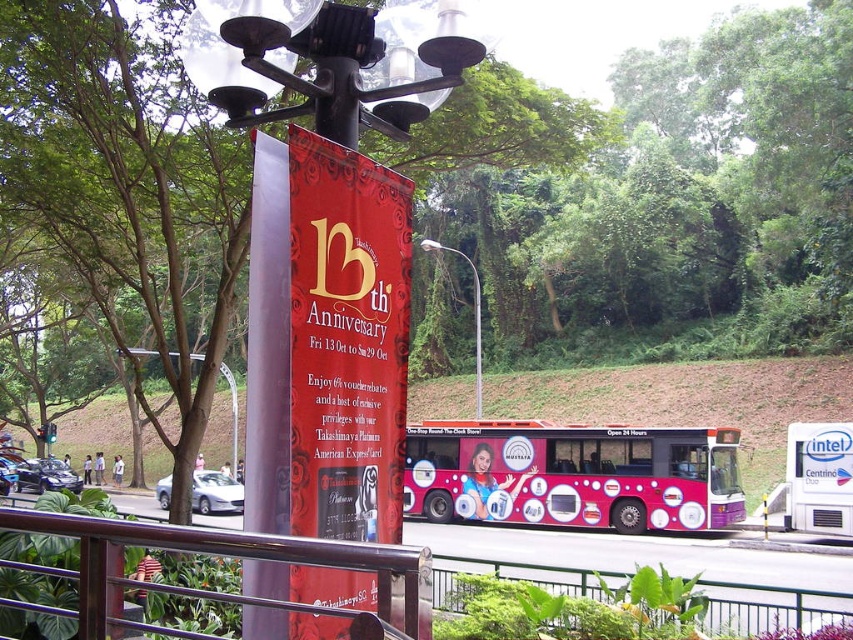
You are a photographer trying to capture the shiny pink bus at center and the metallic silver streetlight at center in a single frame. Based on their positions, which object is casting a shadow on the other?

The metallic silver streetlight at center is casting a shadow on the shiny pink bus at center because the bus is positioned under the streetlight.

You are a pedestrian standing at the lamppost with the red banner. You see a shiny pink bus at center and a metallic silver streetlight at center. Which object is positioned to the right of the other?

The shiny pink bus at center is to the right of metallic silver streetlight at center.

You are standing at the lamppost with the red banner in the urban scene. There are two points marked on the ground in front of you. One is at coordinates point [618,454] and the other at point [230,106]. Which point is farther away from you?

Point [618,454] is farther away because it is behind point [230,106].